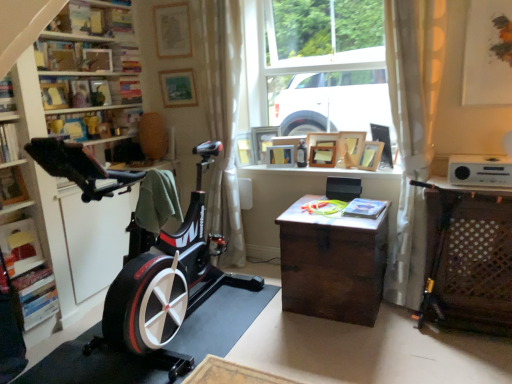
Image resolution: width=512 pixels, height=384 pixels. Describe the element at coordinates (412, 130) in the screenshot. I see `beige dotted curtain at right, marked as the 2th curtain in a left-to-right arrangement` at that location.

Locate an element on the screen. The height and width of the screenshot is (384, 512). wooden picture frame at upper center, the ninth picture frame in the right-to-left sequence is located at coordinates (244, 149).

The height and width of the screenshot is (384, 512). What do you see at coordinates (350, 148) in the screenshot?
I see `wooden picture frame at upper center, placed as the eighth picture frame when sorted from left to right` at bounding box center [350, 148].

Describe the element at coordinates (88, 91) in the screenshot. I see `wooden bookshelf at upper left, placed as the second shelf when sorted from back to front` at that location.

What do you see at coordinates (9, 143) in the screenshot? Image resolution: width=512 pixels, height=384 pixels. I see `hardcover book at left, the second book in the bottom-to-top sequence` at bounding box center [9, 143].

Find the location of `beige dotted curtain at right, marked as the 2th curtain in a left-to-right arrangement`. beige dotted curtain at right, marked as the 2th curtain in a left-to-right arrangement is located at coordinates (412, 130).

From their relative heights in the image, would you say wooden picture frame at upper center, the 3th picture frame when ordered from right to left, is taller or shorter than wooden picture frame at upper right, which appears as the 10th picture frame when viewed from the left?

In the image, wooden picture frame at upper center, the 3th picture frame when ordered from right to left, appears to be shorter than wooden picture frame at upper right, which appears as the 10th picture frame when viewed from the left.

Considering the sizes of wooden picture frame at upper center, the 3th picture frame when ordered from right to left, and wooden picture frame at upper right, the second picture frame from the right, in the image, is wooden picture frame at upper center, the 3th picture frame when ordered from right to left, wider or thinner than wooden picture frame at upper right, the second picture frame from the right,?

Considering their sizes, wooden picture frame at upper center, the 3th picture frame when ordered from right to left, looks broader than wooden picture frame at upper right, the second picture frame from the right.

Is wooden picture frame at upper center, the 3th picture frame when ordered from right to left, to the left or to the right of wooden picture frame at upper right, which appears as the 10th picture frame when viewed from the left, in the image?

Based on their positions, wooden picture frame at upper center, the 3th picture frame when ordered from right to left, is located to the left of wooden picture frame at upper right, which appears as the 10th picture frame when viewed from the left.

In the scene shown: Can you confirm if wooden picture frame at upper center, arranged as the ninth picture frame when viewed from the left, is bigger than wooden picture frame at upper right, the second picture frame from the right?

Incorrect, wooden picture frame at upper center, arranged as the ninth picture frame when viewed from the left, is not larger than wooden picture frame at upper right, the second picture frame from the right.

Is hardcover book at left, the second book in the bottom-to-top sequence, in front of or behind hardcover book at left, which is the third book in bottom-to-top order, in the image?

Clearly, hardcover book at left, the second book in the bottom-to-top sequence, is in front of hardcover book at left, which is the third book in bottom-to-top order.

Would you consider hardcover book at left, marked as the second book in a top-to-bottom arrangement, to be distant from hardcover book at left, positioned as the 1th book in left-to-right order?

→ No, hardcover book at left, marked as the second book in a top-to-bottom arrangement, is in close proximity to hardcover book at left, positioned as the 1th book in left-to-right order.

Does hardcover book at left, acting as the second book starting from the left, appear on the right side of hardcover book at left, arranged as the first book when viewed from the top?

Yes, hardcover book at left, acting as the second book starting from the left, is to the right of hardcover book at left, arranged as the first book when viewed from the top.

Is hardcover book at left, placed as the second book when sorted from right to left, spatially inside hardcover book at left, arranged as the first book when viewed from the top, or outside of it?

hardcover book at left, placed as the second book when sorted from right to left, is located beyond the bounds of hardcover book at left, arranged as the first book when viewed from the top.

Considering the relative positions of wooden picture frame at center, acting as the 6th picture frame starting from the right, and wooden picture frame at center, acting as the fourth picture frame starting from the left, in the image provided, is wooden picture frame at center, acting as the 6th picture frame starting from the right, to the right of wooden picture frame at center, acting as the fourth picture frame starting from the left, from the viewer's perspective?

Yes.

In the image, is wooden picture frame at center, acting as the 6th picture frame starting from the right, positioned in front of or behind wooden picture frame at center, the 8th picture frame viewed from the right?

wooden picture frame at center, acting as the 6th picture frame starting from the right, is in front of wooden picture frame at center, the 8th picture frame viewed from the right.

From the image's perspective, is wooden picture frame at center, the sixth picture frame from the left, positioned above or below wooden picture frame at center, the 8th picture frame viewed from the right?

wooden picture frame at center, the sixth picture frame from the left, is below wooden picture frame at center, the 8th picture frame viewed from the right.

The height and width of the screenshot is (384, 512). In order to click on the 4th picture frame above when counting from the wooden picture frame at center, acting as the 6th picture frame starting from the right (from the image's perspective) in this screenshot , I will do `click(262, 141)`.

Is wooden picture frame at upper center, acting as the fourth picture frame starting from the right, behind hardcover book at left, which is the third book in bottom-to-top order?

Yes, wooden picture frame at upper center, acting as the fourth picture frame starting from the right, is further from the viewer.

How different are the orientations of wooden picture frame at upper center, placed as the eighth picture frame when sorted from left to right, and hardcover book at left, which is the third book in bottom-to-top order, in degrees?

There is a 104-degree angle between the facing directions of wooden picture frame at upper center, placed as the eighth picture frame when sorted from left to right, and hardcover book at left, which is the third book in bottom-to-top order.

Which is behind, point (352, 161) or point (8, 77)?

The point (352, 161) is farther.

From a real-world perspective, which picture frame is the 4th one underneath the hardcover book at left, which is the third book in bottom-to-top order? Please provide its 2D coordinates.

[(350, 148)]

Considering the relative sizes of wooden picture frame at center, the sixth picture frame from the left, and hardcover book at left, which is the third book in bottom-to-top order, in the image provided, is wooden picture frame at center, the sixth picture frame from the left, smaller than hardcover book at left, which is the third book in bottom-to-top order,?

Indeed, wooden picture frame at center, the sixth picture frame from the left, has a smaller size compared to hardcover book at left, which is the third book in bottom-to-top order.

Which is more to the right, wooden picture frame at center, the sixth picture frame from the left, or hardcover book at left, which is the third book in bottom-to-top order?

wooden picture frame at center, the sixth picture frame from the left, is more to the right.

What's the angular difference between wooden picture frame at center, acting as the 6th picture frame starting from the right, and hardcover book at left, which ranks as the third book in right-to-left order,'s facing directions?

The angular difference between wooden picture frame at center, acting as the 6th picture frame starting from the right, and hardcover book at left, which ranks as the third book in right-to-left order, is 72.1 degrees.

Between wooden picture frame at center, the sixth picture frame from the left, and hardcover book at left, which is the third book in bottom-to-top order, which one has less height?

With less height is hardcover book at left, which is the third book in bottom-to-top order.

How many degrees apart are the facing directions of wooden picture frame at upper center, acting as the fourth picture frame starting from the right, and wooden bookshelf at left?

There is a 102-degree angle between the facing directions of wooden picture frame at upper center, acting as the fourth picture frame starting from the right, and wooden bookshelf at left.

Does wooden picture frame at upper center, acting as the fourth picture frame starting from the right, have a greater height compared to wooden bookshelf at left?

In fact, wooden picture frame at upper center, acting as the fourth picture frame starting from the right, may be shorter than wooden bookshelf at left.

Is wooden picture frame at upper center, acting as the fourth picture frame starting from the right, oriented towards wooden bookshelf at left?

No, wooden picture frame at upper center, acting as the fourth picture frame starting from the right, is not oriented towards wooden bookshelf at left.

Does point (362, 136) lie behind point (94, 37)?

Yes, it is behind point (94, 37).

Between point (358, 139) and point (387, 146), which one is positioned behind?

The point (358, 139) is farther.

Which is more to the right, wooden picture frame at upper center, acting as the fourth picture frame starting from the right, or wooden picture frame at upper right, the second picture frame from the right?

wooden picture frame at upper right, the second picture frame from the right.

Consider the image. From a real-world perspective, which is physically below, wooden picture frame at upper center, acting as the fourth picture frame starting from the right, or wooden picture frame at upper right, the second picture frame from the right?

wooden picture frame at upper center, acting as the fourth picture frame starting from the right, is physically lower.

Considering their positions, is wooden picture frame at upper center, placed as the eighth picture frame when sorted from left to right, located in front of or behind wooden picture frame at upper right, which appears as the 10th picture frame when viewed from the left?

wooden picture frame at upper center, placed as the eighth picture frame when sorted from left to right, is behind wooden picture frame at upper right, which appears as the 10th picture frame when viewed from the left.

Locate an element on the screen. picture frame that is the 4th object located below the wooden picture frame at upper right, the second picture frame from the right (from the image's perspective) is located at coordinates (371, 155).

Where is `book that is on the left side of hardcover book at left, placed as the second book when sorted from right to left`? This screenshot has width=512, height=384. book that is on the left side of hardcover book at left, placed as the second book when sorted from right to left is located at coordinates (6, 96).

From the image, which object appears to be nearer to wooden picture frame at center, the 8th picture frame viewed from the right, wooden bookshelf at upper left, acting as the 2th shelf starting from the front, or wooden picture frame at upper center, acting as the seventh picture frame starting from the left?

wooden picture frame at upper center, acting as the seventh picture frame starting from the left.

Based on their spatial positions, is wooden picture frame at upper center, acting as the seventh picture frame starting from the left, or matte wooden picture frame at upper center, which appears as the second picture frame when viewed from the left, closer to matte wood shelf at upper left, the 2th shelf from the bottom?

The object closer to matte wood shelf at upper left, the 2th shelf from the bottom, is matte wooden picture frame at upper center, which appears as the second picture frame when viewed from the left.

From the image, which object appears to be farther from wooden picture frame at upper center, placed as the 5th picture frame when sorted from left to right, wooden chest at center or wooden picture frame at center, acting as the 6th picture frame starting from the right?

Based on the image, wooden chest at center appears to be further to wooden picture frame at upper center, placed as the 5th picture frame when sorted from left to right.

Estimate the real-world distances between objects in this image. Which object is further from matte wood shelf at upper left, the 1th shelf viewed from the back, hardcover book at center, positioned as the 1th book in bottom-to-top order, or wooden bookshelf at upper left, which ranks as the third shelf in bottom-to-top order?

Based on the image, hardcover book at center, positioned as the 1th book in bottom-to-top order, appears to be further to matte wood shelf at upper left, the 1th shelf viewed from the back.

Considering their positions, is wooden picture frame at center, the 8th picture frame viewed from the right, positioned closer to matte wooden shelf at left, positioned as the third shelf in back-to-front order, than wooden picture frame at center, the sixth picture frame from the left?

Based on the image, wooden picture frame at center, the 8th picture frame viewed from the right, appears to be nearer to matte wooden shelf at left, positioned as the third shelf in back-to-front order.

When comparing their distances from wooden picture frame at upper center, the ninth picture frame in the right-to-left sequence, does wooden chest at right or beige dotted curtain at right, marked as the 2th curtain in a left-to-right arrangement, seem closer?

beige dotted curtain at right, marked as the 2th curtain in a left-to-right arrangement, is positioned closer to the anchor wooden picture frame at upper center, the ninth picture frame in the right-to-left sequence.

Which object lies further to the anchor point wooden picture frame at upper center, acting as the seventh picture frame starting from the right, hardcover book at left, marked as the second book in a top-to-bottom arrangement, or white sheer curtain at center, arranged as the 1th curtain when viewed from the left?

The object further to wooden picture frame at upper center, acting as the seventh picture frame starting from the right, is hardcover book at left, marked as the second book in a top-to-bottom arrangement.

Estimate the real-world distances between objects in this image. Which object is further from matte gold picture frame at upper center, placed as the 1th picture frame when sorted from left to right, hardcover book at left, placed as the second book when sorted from right to left, or wooden picture frame at upper center, acting as the seventh picture frame starting from the right?

hardcover book at left, placed as the second book when sorted from right to left.

In order to click on table between matte wooden shelf at left, positioned as the third shelf in back-to-front order, and matte white picture frame at upper right, arranged as the first picture frame when viewed from the right, in the horizontal direction in this screenshot , I will do `click(470, 260)`.

This screenshot has height=384, width=512. What are the coordinates of `bookcase between hardcover book at left, positioned as the 1th book in left-to-right order, and beige dotted curtain at right, marked as the 2th curtain in a left-to-right arrangement` in the screenshot? It's located at (81, 143).

Find the location of a particular element. curtain between matte wooden shelf at left, acting as the 1th shelf starting from the front, and hardcover book at center, positioned as the 1th book in bottom-to-top order, in the horizontal direction is located at coordinates (223, 118).

This screenshot has width=512, height=384. In order to click on book located between hardcover book at left, arranged as the first book when viewed from the top, and wooden picture frame at upper center, acting as the seventh picture frame starting from the right, in the left-right direction in this screenshot , I will do `click(9, 143)`.